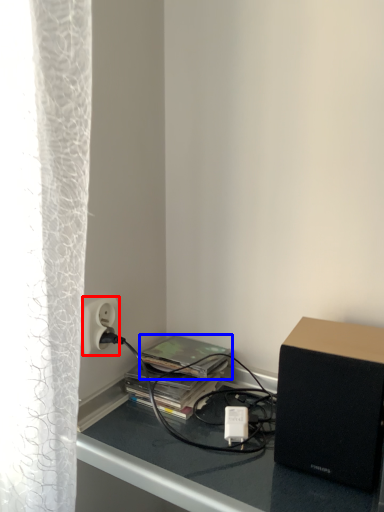
Question: Which of the following is the closest to the observer, power outlet (highlighted by a red box) or paperback book (highlighted by a blue box)?

Choices:
 (A) power outlet
 (B) paperback book

Answer: (A)